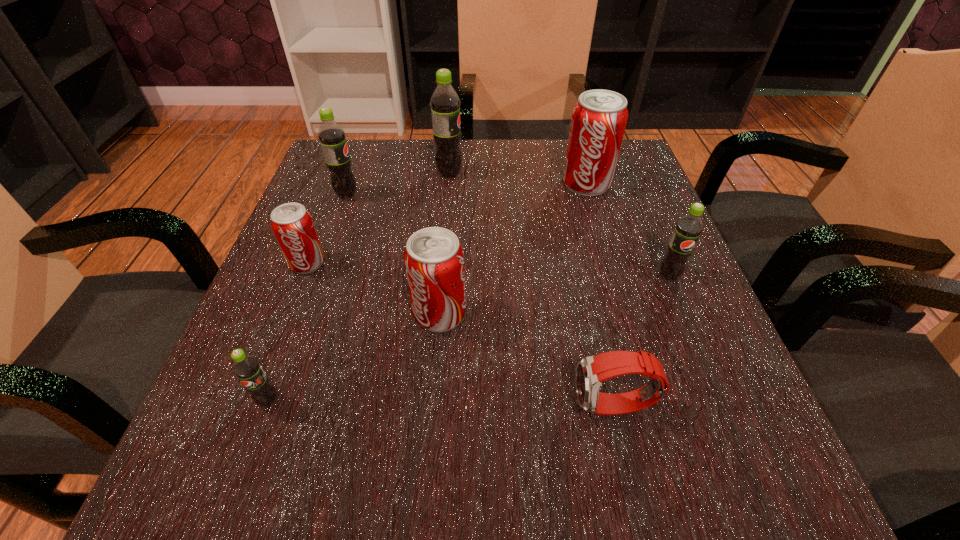
Image resolution: width=960 pixels, height=540 pixels. Find the location of `vacant space located 0.070m on the front label of the nearest green soda`. vacant space located 0.070m on the front label of the nearest green soda is located at coordinates (246, 462).

At what (x,y) coordinates should I click in order to perform the action: click on vacant point located on the face of the red watch. Please return your answer as a coordinate pair (x, y). The image size is (960, 540). Looking at the image, I should click on (409, 407).

This screenshot has width=960, height=540. I want to click on free space located on the face of the red watch, so click(x=495, y=407).

Locate an element on the screen. This screenshot has width=960, height=540. vacant point located 0.190m on the face of the red watch is located at coordinates (438, 407).

What are the coordinates of `watch at the right edge` in the screenshot? It's located at coord(591,371).

Find the location of a particular element. object present at the far left corner is located at coordinates (332, 137).

This screenshot has width=960, height=540. What are the coordinates of `object that is at the far right corner` in the screenshot? It's located at pos(599,118).

The image size is (960, 540). Identify the location of vacant space at the far edge of the desktop. (516, 145).

Identify the location of vacant point at the near edge. This screenshot has height=540, width=960. (381, 483).

Locate an element on the screen. This screenshot has width=960, height=540. free point at the left edge is located at coordinates (280, 300).